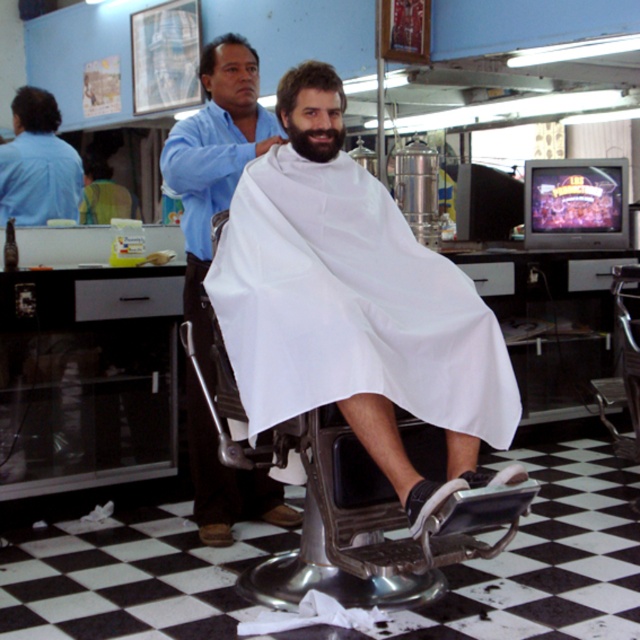
Between white matte cloth at center and blue shirt at upper left, which one appears on the left side from the viewer's perspective?

Positioned to the left is blue shirt at upper left.

Does white matte cloth at center appear over blue shirt at upper left?

No, white matte cloth at center is not above blue shirt at upper left.

Is point (195, 332) positioned in front of point (44, 198)?

Yes, it is.

You are a GUI agent. You are given a task and a screenshot of the screen. Output one action in this format:
    pyautogui.click(x=<x>, y=<y>)
    Task: Click on the white matte cloth at center
    This screenshot has height=640, width=640.
    Given the screenshot: What is the action you would take?
    pyautogui.click(x=214, y=164)

I want to click on blue shirt at upper left, so click(x=36, y=163).

Who is shorter, blue shirt at upper left or brown fuzzy beard at center?

With less height is brown fuzzy beard at center.

At what (x,y) coordinates should I click in order to perform the action: click on blue shirt at upper left. Please return your answer as a coordinate pair (x, y). The width and height of the screenshot is (640, 640). Looking at the image, I should click on (36, 163).

Where is `blue shirt at upper left`? blue shirt at upper left is located at coordinates (36, 163).

From the picture: Does brown matte hair at center have a larger size compared to dark brown hair at upper left?

No, brown matte hair at center is not bigger than dark brown hair at upper left.

Between brown matte hair at center and dark brown hair at upper left, which one has less height?

With less height is brown matte hair at center.

Who is more forward, (298, 90) or (20, 93)?

Point (298, 90) is in front.

Find the location of a particular element. brown matte hair at center is located at coordinates (307, 84).